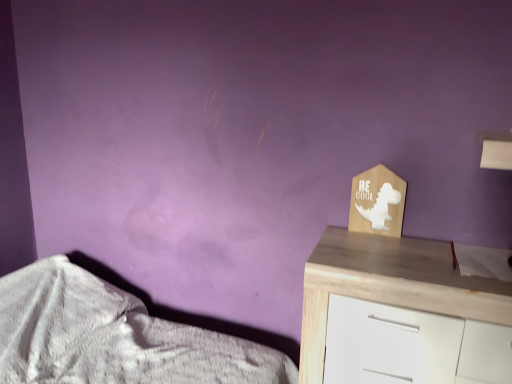
Find the location of a particular element. vacant area on top of wooden chest of drawers at right (from a real-world perspective) is located at coordinates (408, 252).